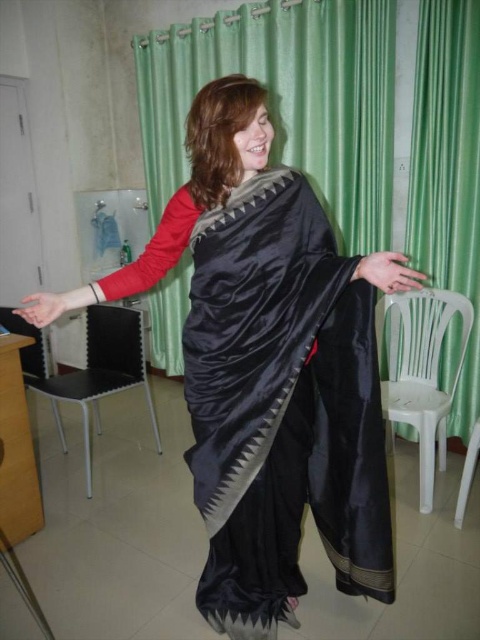
Question: Which of the following is the farthest from the observer?

Choices:
 (A) satin black sari at center
 (B) black leather chair at left
 (C) white plastic chair at lower right
 (D) green satin curtain at right

Answer: (B)

Question: Can you confirm if satin black sari at center is wider than white plastic chair at lower right?

Choices:
 (A) yes
 (B) no

Answer: (A)

Question: Which of the following is the farthest from the observer?

Choices:
 (A) (298, 314)
 (B) (469, 460)
 (C) (127, 378)
 (D) (423, 417)

Answer: (C)

Question: Is the position of green satin curtain at upper center less distant than that of green satin curtain at right?

Choices:
 (A) yes
 (B) no

Answer: (B)

Question: Which of these objects is positioned farthest from the black leather chair at left?

Choices:
 (A) satin black sari at center
 (B) green satin curtain at upper center

Answer: (B)

Question: From the image, what is the correct spatial relationship of white plastic chair at right in relation to white plastic chair at lower right?

Choices:
 (A) left
 (B) right

Answer: (A)